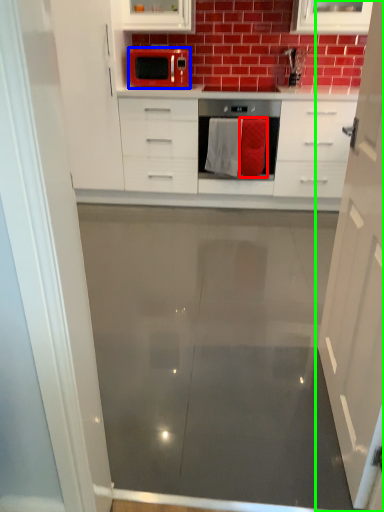
Question: Based on their relative distances, which object is nearer to material (highlighted by a red box)? Choose from microwave oven (highlighted by a blue box) and cabinetry (highlighted by a green box).

Choices:
 (A) microwave oven
 (B) cabinetry

Answer: (A)